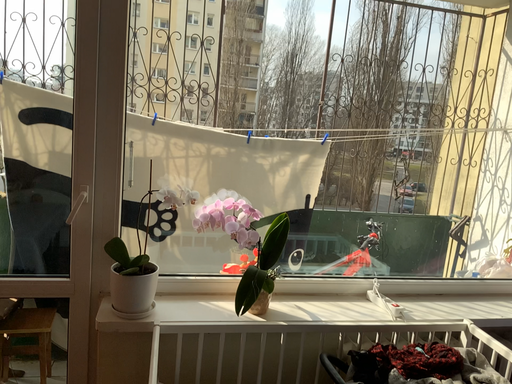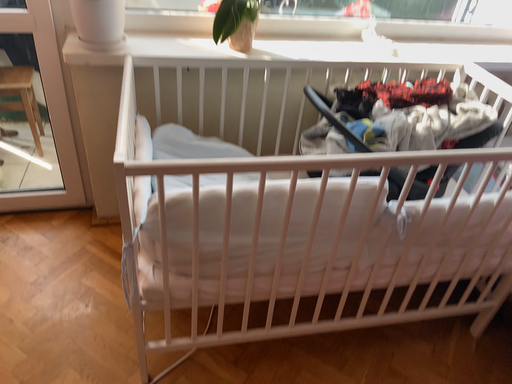
Question: How did the camera likely rotate when shooting the video?

Choices:
 (A) rotated upward
 (B) rotated downward

Answer: (B)